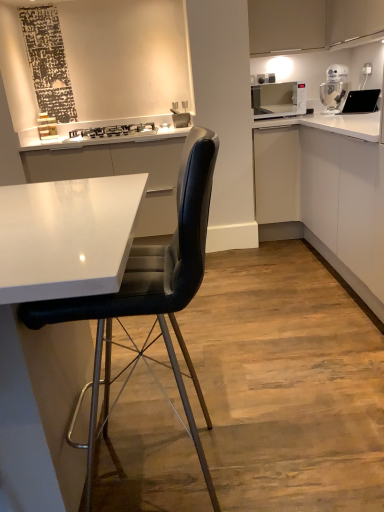
Where is `vacant area that lies to the right of black leather chair at center`? The width and height of the screenshot is (384, 512). vacant area that lies to the right of black leather chair at center is located at coordinates (300, 438).